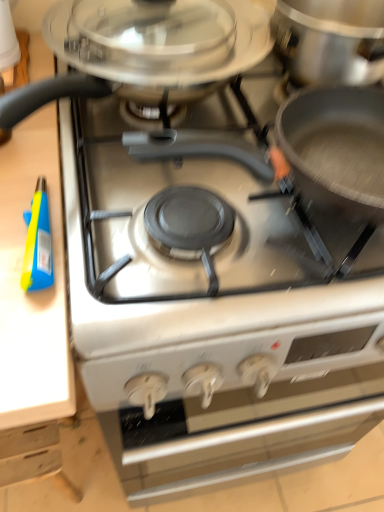
Question: Is white matte oven at center facing towards satin silver cooktop at center?

Choices:
 (A) no
 (B) yes

Answer: (A)

Question: Can you confirm if white matte oven at center is shorter than satin silver cooktop at center?

Choices:
 (A) no
 (B) yes

Answer: (A)

Question: Is white matte oven at center in front of satin silver cooktop at center?

Choices:
 (A) yes
 (B) no

Answer: (B)

Question: From a real-world perspective, is white matte oven at center on satin silver cooktop at center?

Choices:
 (A) yes
 (B) no

Answer: (B)

Question: Is white matte oven at center touching satin silver cooktop at center?

Choices:
 (A) yes
 (B) no

Answer: (B)

Question: From the image's perspective, is satin silver cooktop at center positioned above or below white matte oven at center?

Choices:
 (A) above
 (B) below

Answer: (A)

Question: In the image, is satin silver cooktop at center positioned in front of or behind white matte oven at center?

Choices:
 (A) behind
 (B) front

Answer: (B)

Question: Would you say satin silver cooktop at center is inside or outside white matte oven at center?

Choices:
 (A) inside
 (B) outside

Answer: (B)

Question: From a real-world perspective, is satin silver cooktop at center physically located above or below white matte oven at center?

Choices:
 (A) above
 (B) below

Answer: (A)

Question: Considering the positions of white matte oven at center and satin silver cooktop at center in the image, is white matte oven at center wider or thinner than satin silver cooktop at center?

Choices:
 (A) wide
 (B) thin

Answer: (B)

Question: Is point (302, 402) closer or farther from the camera than point (89, 96)?

Choices:
 (A) farther
 (B) closer

Answer: (A)

Question: Based on their positions, is white matte oven at center located to the left or right of satin silver cooktop at center?

Choices:
 (A) left
 (B) right

Answer: (B)

Question: In terms of size, does white matte oven at center appear bigger or smaller than satin silver cooktop at center?

Choices:
 (A) small
 (B) big

Answer: (B)

Question: Is blue plastic spray bottle at left wider or thinner than satin silver cooktop at center?

Choices:
 (A) wide
 (B) thin

Answer: (B)

Question: Considering the positions of blue plastic spray bottle at left and satin silver cooktop at center in the image, is blue plastic spray bottle at left bigger or smaller than satin silver cooktop at center?

Choices:
 (A) small
 (B) big

Answer: (A)